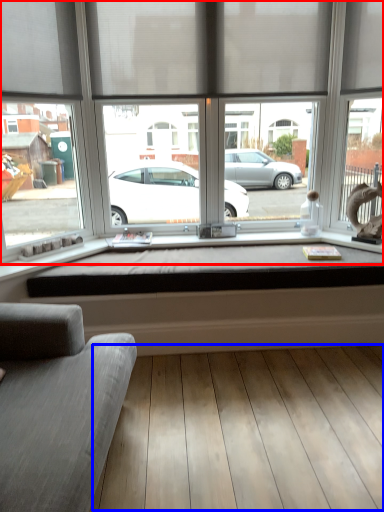
Question: Among these objects, which one is nearest to the camera, window (highlighted by a red box) or plank (highlighted by a blue box)?

Choices:
 (A) window
 (B) plank

Answer: (B)